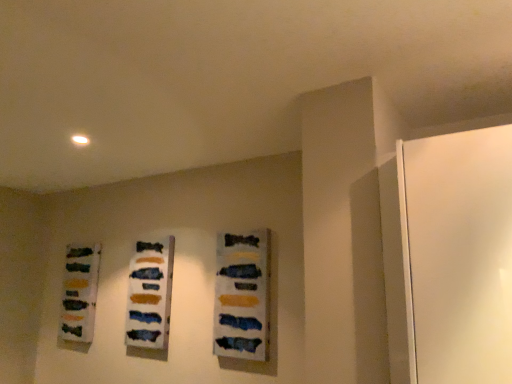
Question: Should I look upward or downward to see matte acrylic painting at center, the third art when ordered from back to front?

Choices:
 (A) up
 (B) down

Answer: (B)

Question: Does matte acrylic painting at center, which ranks as the second art in left-to-right order, appear on the right side of matte glass bottles at left, arranged as the 3th art when viewed from the front?

Choices:
 (A) no
 (B) yes

Answer: (B)

Question: Is matte acrylic painting at center, which ranks as the second art in left-to-right order, further to the viewer compared to matte glass bottles at left, the 1th art from the left?

Choices:
 (A) yes
 (B) no

Answer: (B)

Question: Can you confirm if matte acrylic painting at center, which appears as the second art when viewed from the back, is smaller than matte glass bottles at left, the 1th art from the left?

Choices:
 (A) yes
 (B) no

Answer: (A)

Question: Is matte acrylic painting at center, which ranks as the second art in front-to-back order, oriented away from matte glass bottles at left, arranged as the 3th art when viewed from the front?

Choices:
 (A) yes
 (B) no

Answer: (B)

Question: Considering the relative sizes of matte acrylic painting at center, which ranks as the second art in front-to-back order, and matte glass bottles at left, which appears as the first art when viewed from the back, in the image provided, is matte acrylic painting at center, which ranks as the second art in front-to-back order, thinner than matte glass bottles at left, which appears as the first art when viewed from the back,?

Choices:
 (A) yes
 (B) no

Answer: (A)

Question: Considering the relative sizes of matte acrylic painting at center, which appears as the second art when viewed from the back, and matte glass bottles at left, arranged as the 3th art when viewed from the front, in the image provided, is matte acrylic painting at center, which appears as the second art when viewed from the back, bigger than matte glass bottles at left, arranged as the 3th art when viewed from the front,?

Choices:
 (A) yes
 (B) no

Answer: (B)

Question: Is matte glass bottles at left, arranged as the 3th art when viewed from the front, completely or partially outside of matte acrylic painting at center, which ranks as the second art in left-to-right order?

Choices:
 (A) yes
 (B) no

Answer: (A)

Question: From a real-world perspective, does matte glass bottles at left, arranged as the 3th art when viewed from the front, sit lower than matte acrylic painting at center, which appears as the second art when viewed from the back?

Choices:
 (A) no
 (B) yes

Answer: (A)

Question: Is matte glass bottles at left, arranged as the 3th art when viewed from the right, at the right side of matte acrylic painting at center, which ranks as the second art in left-to-right order?

Choices:
 (A) no
 (B) yes

Answer: (A)

Question: From the image's perspective, would you say matte glass bottles at left, which appears as the first art when viewed from the back, is shown under matte acrylic painting at center, which ranks as the second art in left-to-right order?

Choices:
 (A) no
 (B) yes

Answer: (B)

Question: Is matte glass bottles at left, the 1th art from the left, thinner than matte acrylic painting at center, which appears as the second art when viewed from the back?

Choices:
 (A) yes
 (B) no

Answer: (B)

Question: Is matte glass bottles at left, arranged as the 3th art when viewed from the front, turned away from matte acrylic painting at center, which appears as the second art when viewed from the back?

Choices:
 (A) no
 (B) yes

Answer: (A)

Question: Does matte acrylic painting at center, which ranks as the second art in left-to-right order, have a lesser height compared to matte acrylic painting at center, the first art positioned from the right?

Choices:
 (A) no
 (B) yes

Answer: (A)